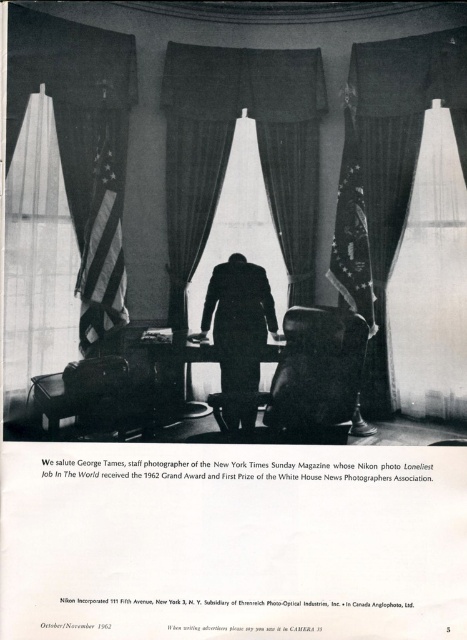
What do you see at coordinates (37, 257) in the screenshot? I see `translucent fabric curtain at left` at bounding box center [37, 257].

Does translucent fabric curtain at left have a greater height compared to smooth wooden table at center?

Yes.

Which is behind, point (28, 108) or point (281, 344)?

Point (281, 344)

Where is `translucent fabric curtain at left`? The image size is (467, 640). translucent fabric curtain at left is located at coordinates (37, 257).

Can you confirm if silky white curtain at center is taller than black suit at center?

Correct, silky white curtain at center is much taller as black suit at center.

Is point (115, 97) in front of point (221, 364)?

Yes, it is.

Does point (14, 141) come in front of point (246, 262)?

Yes, point (14, 141) is in front of point (246, 262).

The image size is (467, 640). I want to click on silky white curtain at center, so click(82, 145).

Does silky white curtain at center have a greater height compared to translucent fabric curtain at left?

Indeed, silky white curtain at center has a greater height compared to translucent fabric curtain at left.

Does silky white curtain at center appear on the left side of translucent fabric curtain at left?

In fact, silky white curtain at center is to the right of translucent fabric curtain at left.

Image resolution: width=467 pixels, height=640 pixels. I want to click on silky white curtain at center, so click(x=82, y=145).